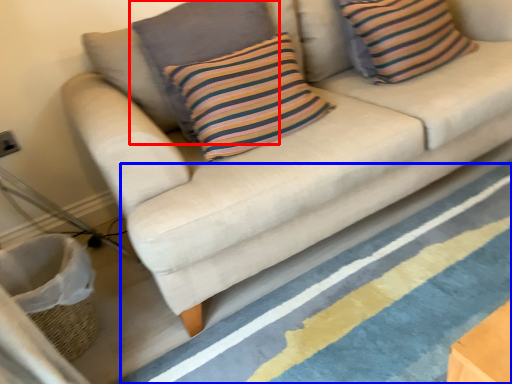
Question: Which object appears closest to the camera in this image, pillow (highlighted by a red box) or stripe (highlighted by a blue box)?

Choices:
 (A) pillow
 (B) stripe

Answer: (B)